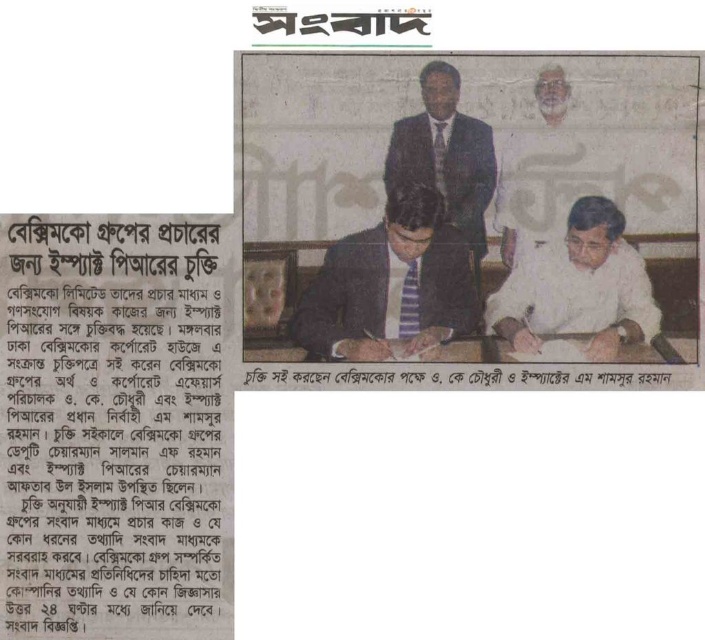
Question: Estimate the real-world distances between objects in this image. Which object is farther from the matte black suit at center?

Choices:
 (A) white paper text at upper left
 (B) white matte shirt at center

Answer: (A)

Question: Can you confirm if white paper text at upper left is thinner than dark blue suit at center?

Choices:
 (A) no
 (B) yes

Answer: (A)

Question: Does white paper text at upper left appear under white matte shirt at center?

Choices:
 (A) no
 (B) yes

Answer: (B)

Question: Does white paper text at upper left have a smaller size compared to dark blue suit at center?

Choices:
 (A) yes
 (B) no

Answer: (B)

Question: Estimate the real-world distances between objects in this image. Which object is closer to the dark blue suit at center?

Choices:
 (A) white matte shirt at center
 (B) matte black suit at center
 (C) white paper text at upper left

Answer: (B)

Question: Which point is farther from the camera taking this photo?

Choices:
 (A) (123, 497)
 (B) (529, 340)
 (C) (396, 173)

Answer: (C)